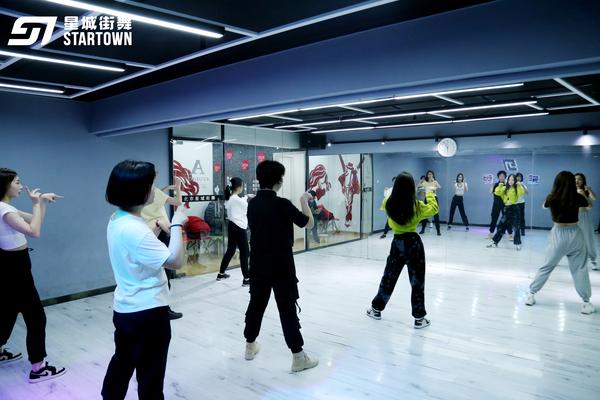
Locate an element on the screen. reflections of baseboards is located at coordinates (476, 224), (377, 231).